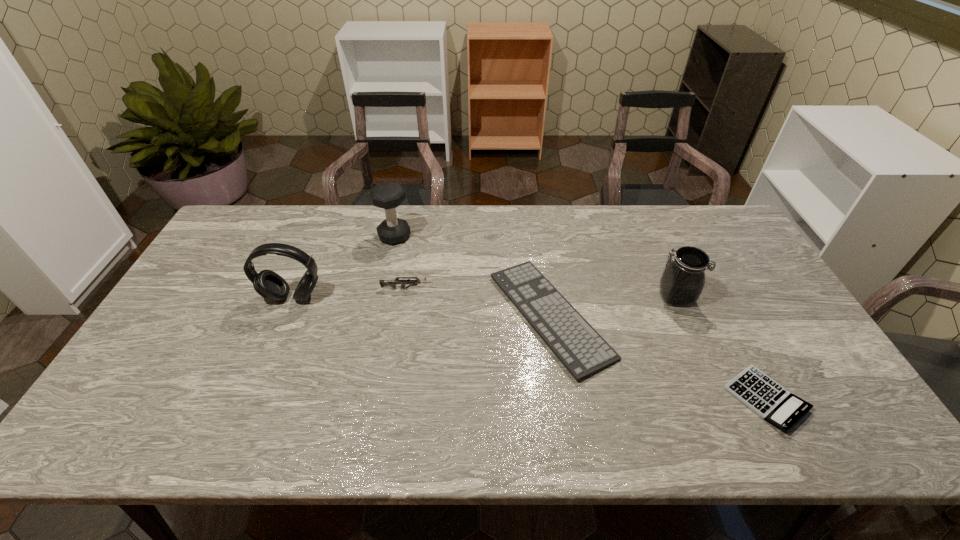
Identify the location of free space at the left edge. (219, 296).

Where is `vacant space at the right edge of the desktop`? This screenshot has width=960, height=540. vacant space at the right edge of the desktop is located at coordinates (763, 276).

Image resolution: width=960 pixels, height=540 pixels. In the image, there is a desktop. Identify the location of vacant space at the near left corner. (162, 433).

Where is `vacant space that's between the headset and the shortest object`? The width and height of the screenshot is (960, 540). vacant space that's between the headset and the shortest object is located at coordinates (529, 348).

The width and height of the screenshot is (960, 540). I want to click on blank region between the third shortest object and the leftmost object, so click(350, 293).

In order to click on vacant space that is in between the jar and the calculator in this screenshot , I will do `click(721, 348)`.

Identify the location of empty space that is in between the farthest object and the leftmost object. (344, 267).

You are a GUI agent. You are given a task and a screenshot of the screen. Output one action in this format:
    pyautogui.click(x=<x>, y=<y>)
    Task: Click on the free spot between the third object from right to left and the jar
    The width and height of the screenshot is (960, 540).
    Given the screenshot: What is the action you would take?
    pyautogui.click(x=612, y=306)

Point out which object is positioned as the fifth nearest to the dumbbell. Please provide its 2D coordinates. Your answer should be formatted as a tuple, i.e. [(x, y)], where the tuple contains the x and y coordinates of a point satisfying the conditions above.

[(768, 399)]

This screenshot has height=540, width=960. What are the coordinates of `the second closest object relative to the fourth shortest object` in the screenshot? It's located at (768, 399).